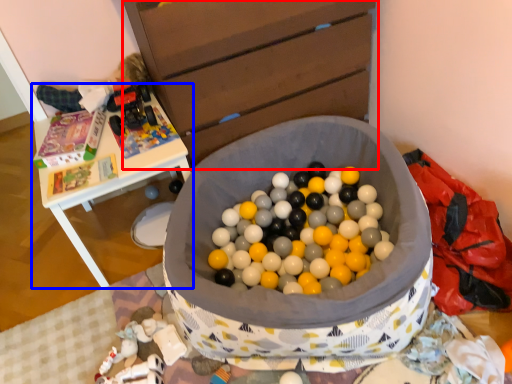
Question: Which of the following is the closest to the observer, chest of drawers (highlighted by a red box) or table (highlighted by a blue box)?

Choices:
 (A) chest of drawers
 (B) table

Answer: (A)